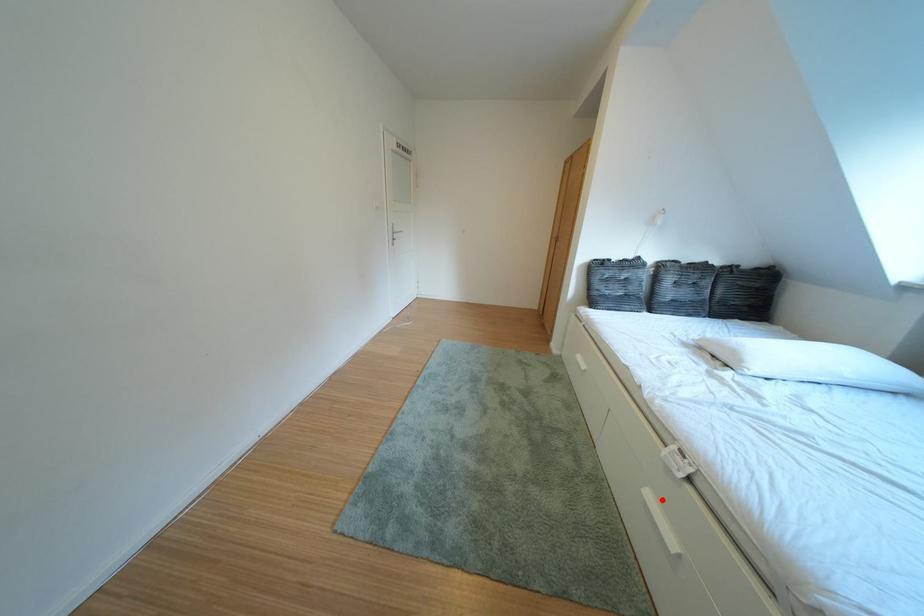
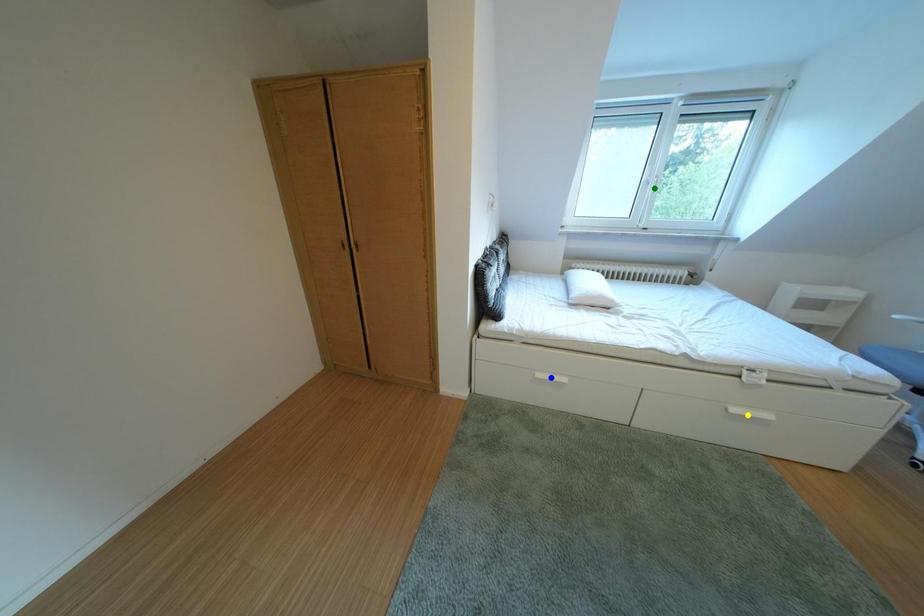
Question: I am providing you with two images of the same scene from different viewpoints. A red point is marked on the first image. You are given multiple points on the second image. Which point in image 2 represents the same 3d spot as the red point in image 1?

Choices:
 (A) green point
 (B) blue point
 (C) yellow point

Answer: (C)